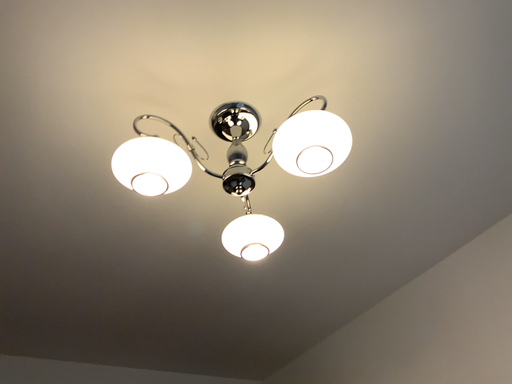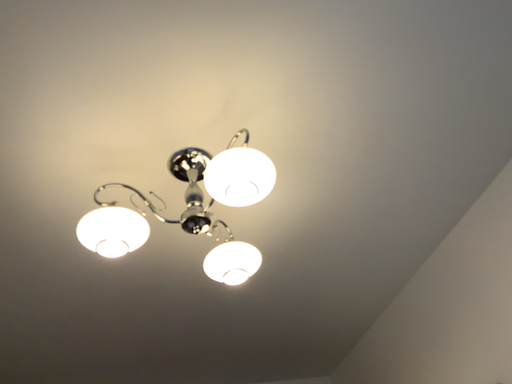
Question: How did the camera likely rotate when shooting the video?

Choices:
 (A) rotated right
 (B) rotated left

Answer: (B)